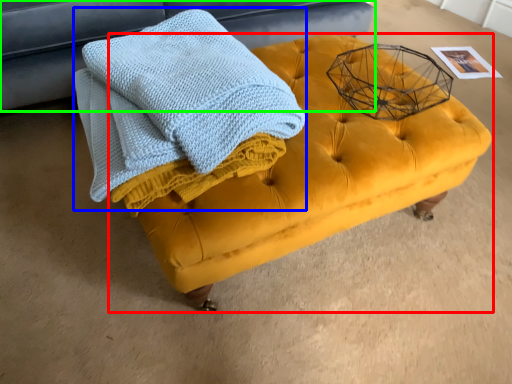
Question: Which object is the farthest from table (highlighted by a red box)? Choose among these: bath towel (highlighted by a blue box) or furniture (highlighted by a green box).

Choices:
 (A) bath towel
 (B) furniture

Answer: (B)